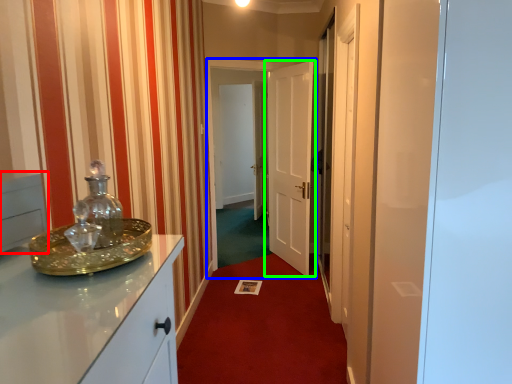
Question: Estimate the real-world distances between objects in this image. Which object is closer to cabinetry (highlighted by a red box), glass door (highlighted by a blue box) or door (highlighted by a green box)?

Choices:
 (A) glass door
 (B) door

Answer: (A)